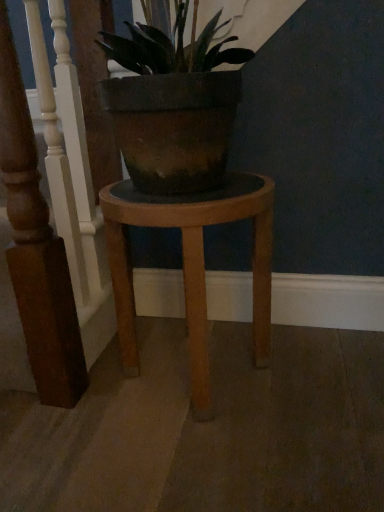
Find the location of a particular element. The height and width of the screenshot is (512, 384). vacant space in wooden stool at center (from a real-world perspective) is located at coordinates (184, 369).